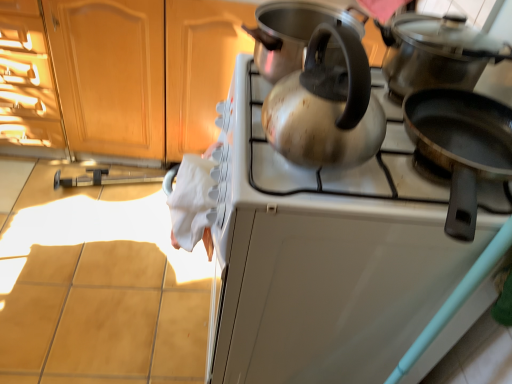
Question: Looking at their shapes, would you say satin silver kettle at center is wider or thinner than satin silver kettle at upper center?

Choices:
 (A) wide
 (B) thin

Answer: (B)

Question: From a real-world perspective, relative to satin silver kettle at upper center, is satin silver kettle at center vertically above or below?

Choices:
 (A) below
 (B) above

Answer: (B)

Question: Which is farther from the shiny black pot at upper right, the third kitchen appliance positioned from the bottom?

Choices:
 (A) black non-stick frying pan at right, the third kitchen appliance positioned from the top
 (B) satin silver kettle at center
 (C) wooden cabinet at upper left
 (D) shiny metallic kettle at upper center, arranged as the 2th kitchen appliance when viewed from the top
 (E) satin silver kettle at upper center

Answer: (C)

Question: Which is nearer to the satin silver kettle at center?

Choices:
 (A) black non-stick frying pan at right, which is counted as the 1th kitchen appliance, starting from the bottom
 (B) satin silver kettle at upper center
 (C) wooden cabinet at upper left
 (D) shiny metallic kettle at upper center, arranged as the 2th kitchen appliance when viewed from the top
 (E) shiny black pot at upper right, the third kitchen appliance positioned from the bottom

Answer: (D)